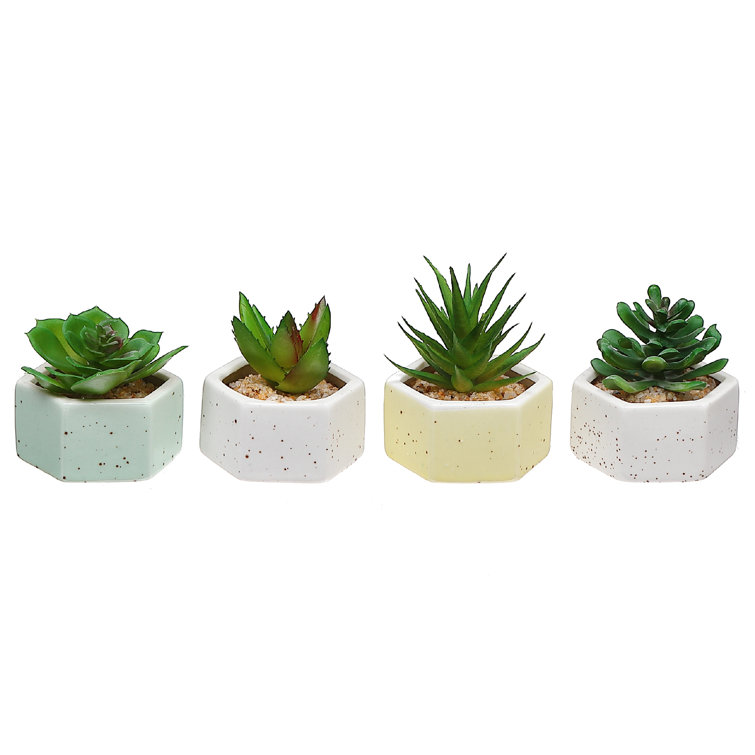
The width and height of the screenshot is (755, 755). What are the coordinates of `rocks on the bottom of the planter on the far right` in the screenshot? It's located at (655, 392).